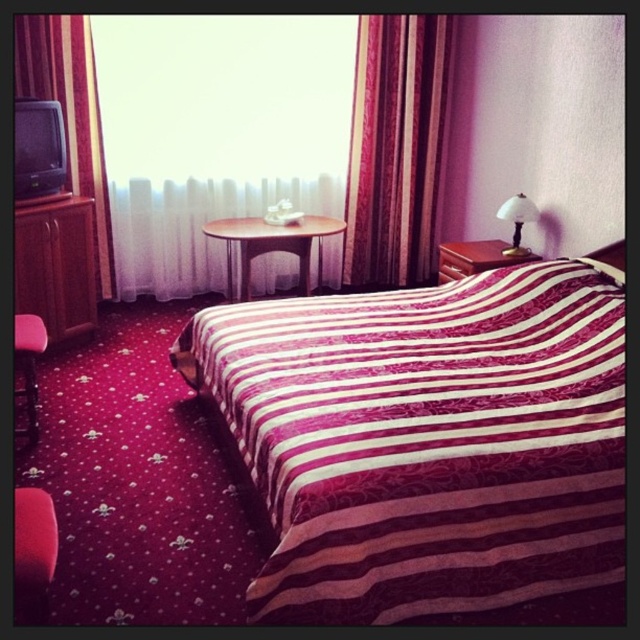
You are standing in the bedroom and want to check the position of the point marked at coordinates (70,112). Based on the scene description, where exactly is this point located?

The point marked at coordinates (70,112) is located on the velvet like burgundy curtain at left.